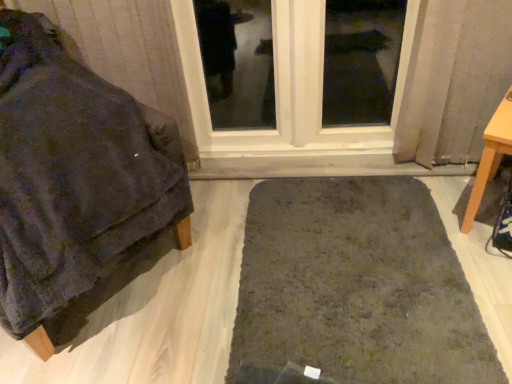
Question: Is clear glass window at center at the right side of light brown wooden table at right, positioned as the first furniture in right-to-left order?

Choices:
 (A) yes
 (B) no

Answer: (B)

Question: Considering the relative sizes of clear glass window at center and light brown wooden table at right, positioned as the first furniture in right-to-left order, in the image provided, is clear glass window at center thinner than light brown wooden table at right, positioned as the first furniture in right-to-left order,?

Choices:
 (A) no
 (B) yes

Answer: (B)

Question: From the image's perspective, does clear glass window at center appear lower than light brown wooden table at right, positioned as the first furniture in right-to-left order?

Choices:
 (A) yes
 (B) no

Answer: (B)

Question: From the image's perspective, is clear glass window at center located above light brown wooden table at right, the 2th furniture viewed from the left?

Choices:
 (A) yes
 (B) no

Answer: (A)

Question: Is clear glass window at center not close to light brown wooden table at right, positioned as the first furniture in right-to-left order?

Choices:
 (A) no
 (B) yes

Answer: (A)

Question: Considering the relative sizes of clear glass window at center and light brown wooden table at right, positioned as the first furniture in right-to-left order, in the image provided, is clear glass window at center taller than light brown wooden table at right, positioned as the first furniture in right-to-left order,?

Choices:
 (A) no
 (B) yes

Answer: (B)

Question: Is velvety dark gray blanket at left, positioned as the second furniture in right-to-left order, thinner than dark green shaggy rug at center?

Choices:
 (A) no
 (B) yes

Answer: (B)

Question: Does velvety dark gray blanket at left, positioned as the second furniture in right-to-left order, contain dark green shaggy rug at center?

Choices:
 (A) no
 (B) yes

Answer: (A)

Question: Is velvety dark gray blanket at left, which is counted as the first furniture, starting from the left, at the left side of dark green shaggy rug at center?

Choices:
 (A) yes
 (B) no

Answer: (A)

Question: From the image's perspective, does velvety dark gray blanket at left, positioned as the second furniture in right-to-left order, appear lower than dark green shaggy rug at center?

Choices:
 (A) no
 (B) yes

Answer: (A)

Question: Can we say velvety dark gray blanket at left, which is counted as the first furniture, starting from the left, lies outside dark green shaggy rug at center?

Choices:
 (A) yes
 (B) no

Answer: (A)

Question: Could you tell me if velvety dark gray blanket at left, positioned as the second furniture in right-to-left order, is turned towards dark green shaggy rug at center?

Choices:
 (A) yes
 (B) no

Answer: (B)

Question: Can you confirm if light brown wooden table at right, the 2th furniture viewed from the left, is thinner than dark green shaggy rug at center?

Choices:
 (A) no
 (B) yes

Answer: (B)